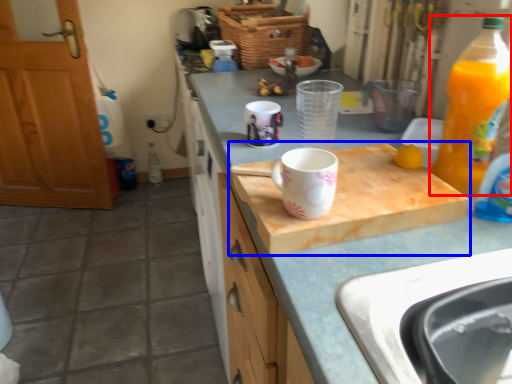
Question: Which object appears closest to the camera in this image, bottle (highlighted by a red box) or cutting board (highlighted by a blue box)?

Choices:
 (A) bottle
 (B) cutting board

Answer: (A)